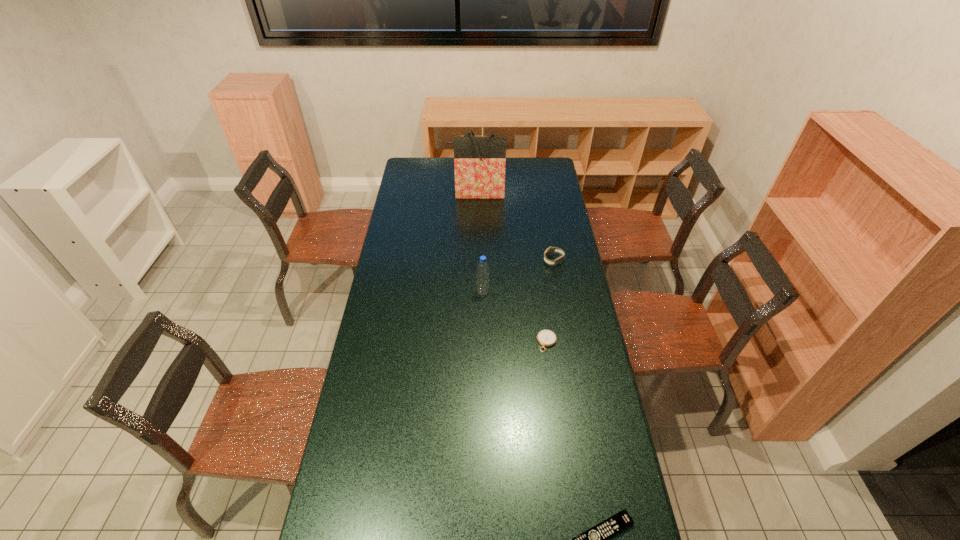
The width and height of the screenshot is (960, 540). I want to click on free space that satisfies the following two spatial constraints: 1. on the front side of the water bottle; 2. on the left side of the shopping bag, so click(x=475, y=292).

In order to click on free space that satisfies the following two spatial constraints: 1. on the front side of the farthest object; 2. on the left side of the compass in this screenshot , I will do `click(475, 342)`.